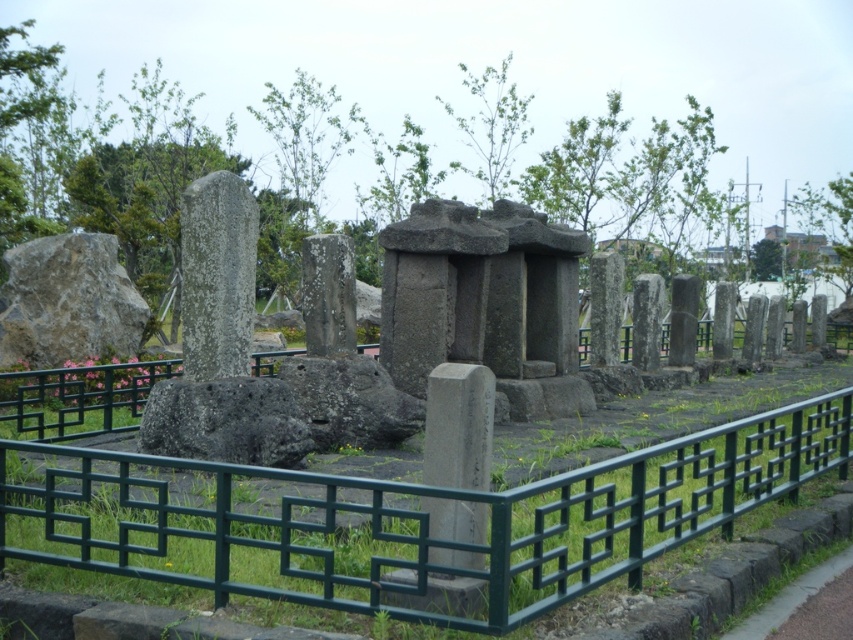
Can you confirm if green metal fence at center is positioned to the left of smooth gray stone monument at center?

No, green metal fence at center is not to the left of smooth gray stone monument at center.

Between green metal fence at center and smooth gray stone monument at center, which one is positioned higher?

smooth gray stone monument at center is higher up.

Is point (154, 532) behind point (310, 284)?

No, it is in front of (310, 284).

Where is `green metal fence at center`? The width and height of the screenshot is (853, 640). green metal fence at center is located at coordinates (405, 516).

Looking at this image, does green metal fence at center appear under gray stone pillar at center?

Yes.

How far apart are green metal fence at center and gray stone pillar at center?

green metal fence at center is 17.05 inches from gray stone pillar at center.

Locate an element on the screen. green metal fence at center is located at coordinates (405, 516).

You are a GUI agent. You are given a task and a screenshot of the screen. Output one action in this format:
    pyautogui.click(x=<x>, y=<y>)
    Task: Click on the green metal fence at center
    
    Given the screenshot: What is the action you would take?
    pyautogui.click(x=405, y=516)

Can you confirm if gray stone pillar at center is thinner than smooth gray stone monument at center?

Correct, gray stone pillar at center's width is less than smooth gray stone monument at center's.

Which is more to the left, gray stone pillar at center or smooth gray stone monument at center?

Positioned to the left is smooth gray stone monument at center.

The width and height of the screenshot is (853, 640). Identify the location of gray stone pillar at center. point(457,426).